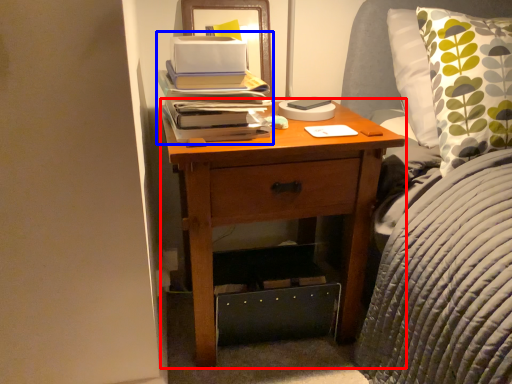
Question: Which object appears farthest to the camera in this image, nightstand (highlighted by a red box) or book (highlighted by a blue box)?

Choices:
 (A) nightstand
 (B) book

Answer: (B)